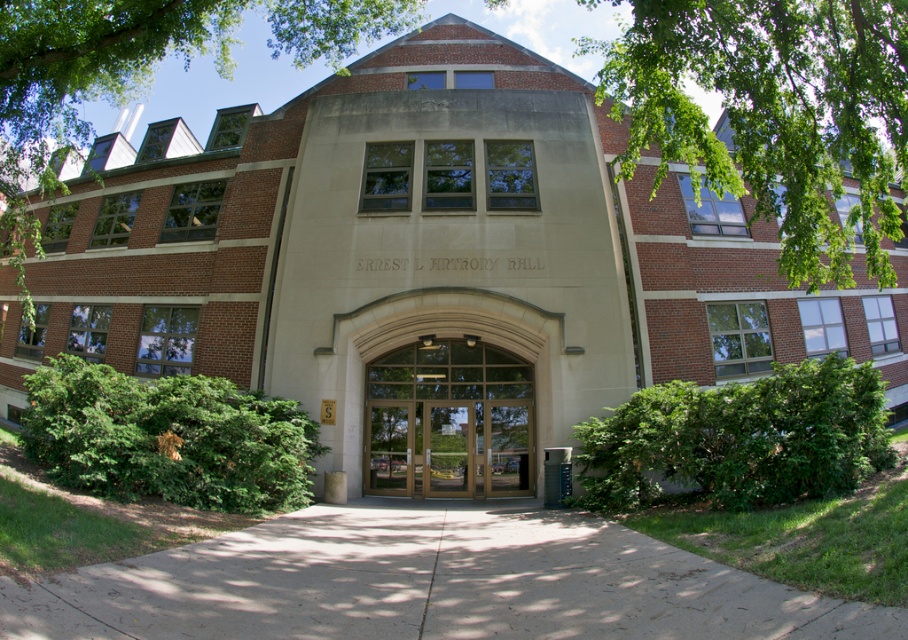
Question: Does green leafy tree at upper left have a lesser width compared to wooden doors at center?

Choices:
 (A) yes
 (B) no

Answer: (B)

Question: From the image, what is the correct spatial relationship of green leafy tree at upper right in relation to wooden doors at center?

Choices:
 (A) right
 (B) left

Answer: (A)

Question: Which point is farther from the camera taking this photo?

Choices:
 (A) (509, 404)
 (B) (85, 8)

Answer: (A)

Question: Does green leafy tree at upper right appear on the right side of wooden doors at center?

Choices:
 (A) no
 (B) yes

Answer: (B)

Question: Which of the following is the closest to the observer?

Choices:
 (A) green leafy tree at upper right
 (B) wooden doors at center

Answer: (A)

Question: Which of these objects is positioned farthest from the wooden doors at center?

Choices:
 (A) green leafy tree at upper right
 (B) green leafy tree at upper left

Answer: (A)